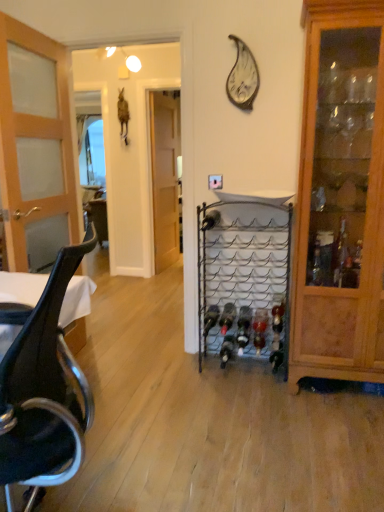
Where is `free space that is to the left of black glass wine bottle at center, which is the sixth wine bottle in right-to-left order`? This screenshot has width=384, height=512. free space that is to the left of black glass wine bottle at center, which is the sixth wine bottle in right-to-left order is located at coordinates (206, 368).